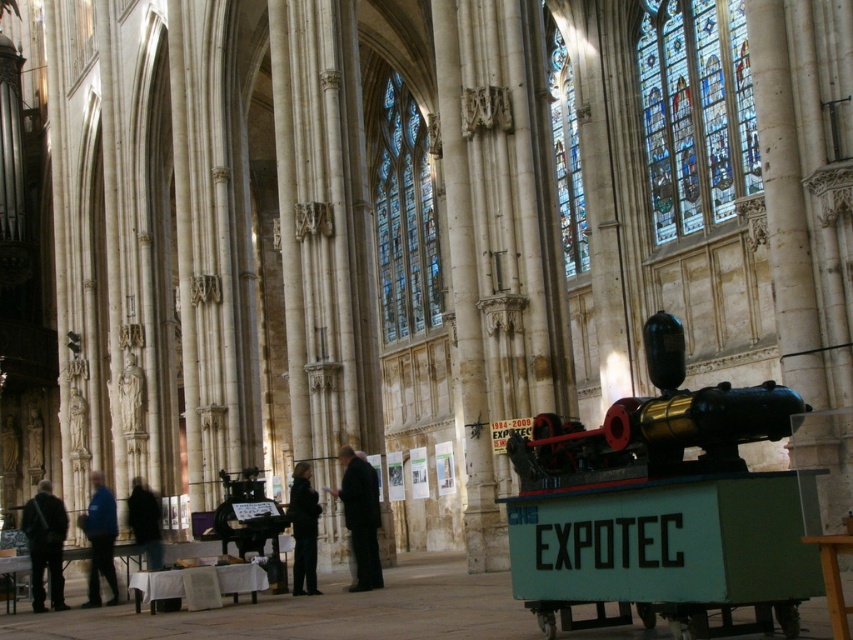
Question: Which point is closer to the camera taking this photo?

Choices:
 (A) (416, 154)
 (B) (550, 582)

Answer: (B)

Question: Where is stained glass at center located in relation to dark fabric jacket at lower left in the image?

Choices:
 (A) below
 (B) above

Answer: (B)

Question: Does stained glass at center appear on the left side of blue fabric jacket at lower left?

Choices:
 (A) yes
 (B) no

Answer: (B)

Question: Is stained glass at center smaller than dark fabric jacket at lower left?

Choices:
 (A) no
 (B) yes

Answer: (A)

Question: Which object appears closest to the camera in this image?

Choices:
 (A) dark suit at center
 (B) blue stained glass at upper center
 (C) stained glass at center

Answer: (A)

Question: Which of these objects is positioned farthest from the stained glass at upper right?

Choices:
 (A) stained glass at center
 (B) blue stained glass at upper center
 (C) metallic gold train at center
 (D) dark suit at center

Answer: (A)